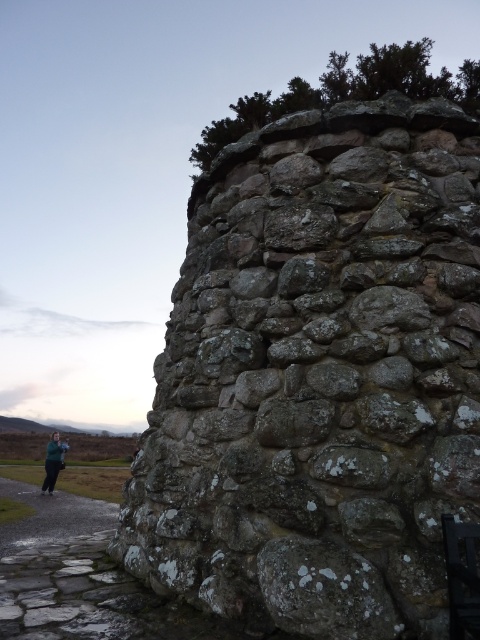
Question: Can you confirm if lichen-covered stone at center is thinner than green fabric jacket at lower left?

Choices:
 (A) yes
 (B) no

Answer: (A)

Question: Among these points, which one is farthest from the camera?

Choices:
 (A) (421, 557)
 (B) (56, 444)

Answer: (B)

Question: Which of the following is the closest to the observer?

Choices:
 (A) lichen-covered stone at center
 (B) green fabric jacket at lower left

Answer: (A)

Question: Is lichen-covered stone at center smaller than green fabric jacket at lower left?

Choices:
 (A) no
 (B) yes

Answer: (B)

Question: Is lichen-covered stone at center in front of green fabric jacket at lower left?

Choices:
 (A) no
 (B) yes

Answer: (B)